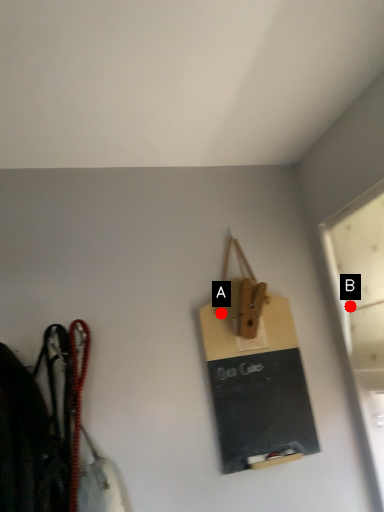
Question: Two points are circled on the image, labeled by A and B beside each circle. Which point appears farthest from the camera in this image?

Choices:
 (A) A is further
 (B) B is further

Answer: (B)